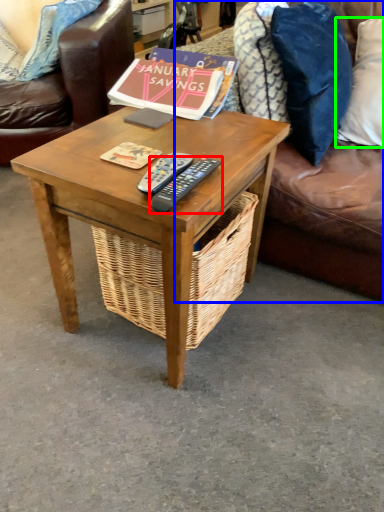
Question: Which object is the farthest from remote control (highlighted by a red box)? Choose among these: studio couch (highlighted by a blue box) or pillow (highlighted by a green box).

Choices:
 (A) studio couch
 (B) pillow

Answer: (B)